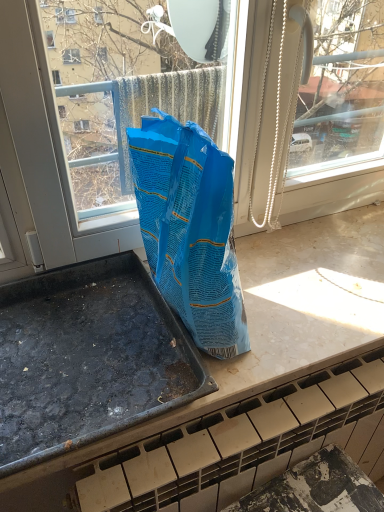
In order to face marble tile window sill at center, should I rotate leftwards or rightwards?

A: To face it directly, rotate right by 8.479 degrees.

At what (x,y) coordinates should I click in order to perform the action: click on marble tile window sill at center. Please return your answer as a coordinate pair (x, y). Looking at the image, I should click on (283, 317).

Describe the element at coordinates (283, 317) in the screenshot. I see `marble tile window sill at center` at that location.

Identify the location of marble tile window sill at center. (283, 317).